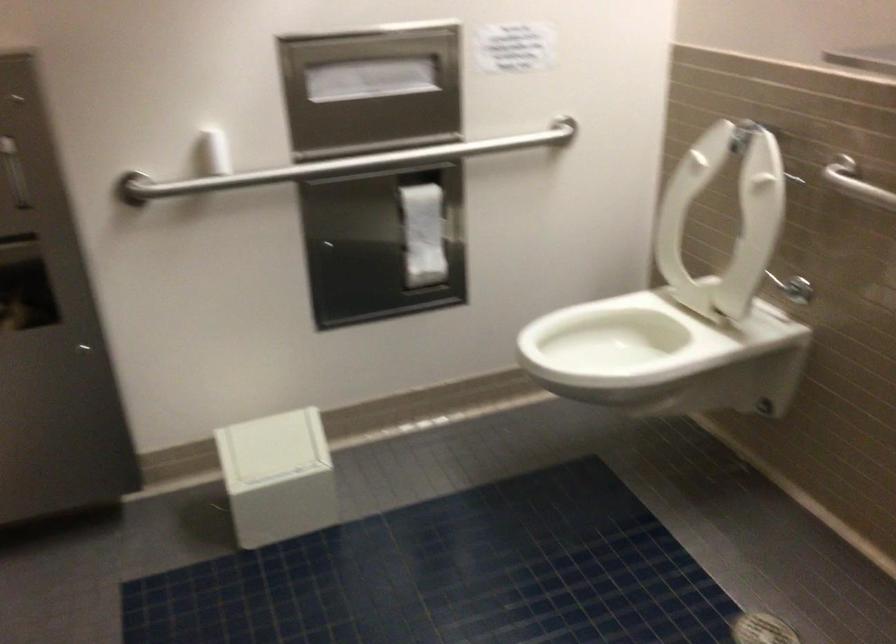
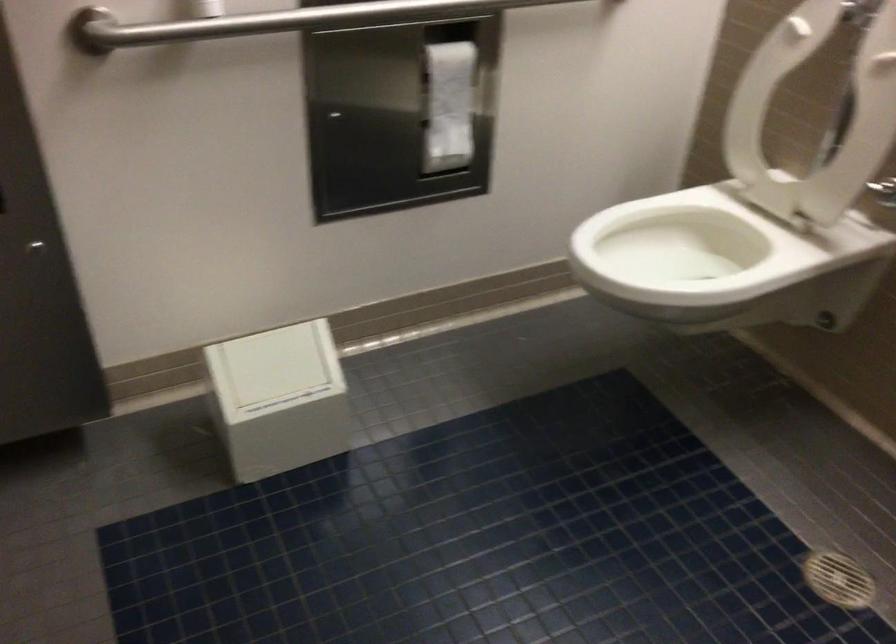
Where in the second image is the point corresponding to (277,172) from the first image?

(279, 21)